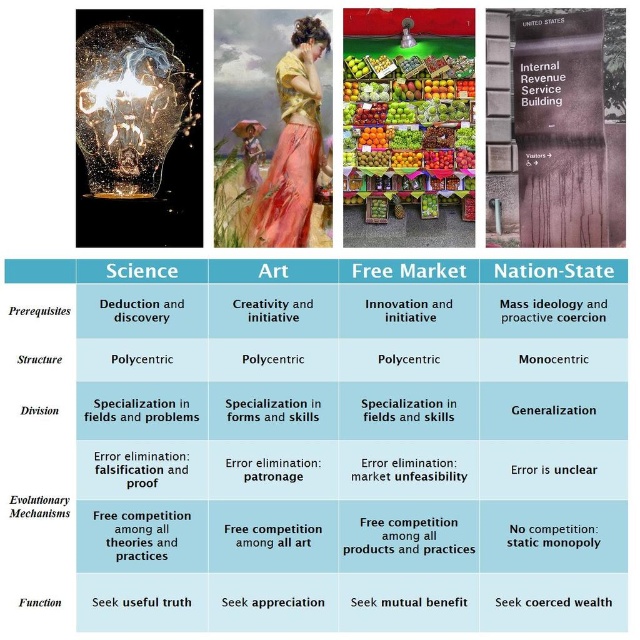
Does translucent glass bulb at upper left have a greater width compared to matte silver lamp at center?

Yes.

How distant is translucent glass bulb at upper left from matte silver lamp at center?

translucent glass bulb at upper left is 29.07 inches from matte silver lamp at center.

Locate an element on the screen. This screenshot has height=640, width=640. translucent glass bulb at upper left is located at coordinates (129, 106).

What do you see at coordinates (410, 131) in the screenshot? I see `shiny plastic fruits at center` at bounding box center [410, 131].

Is shiny plastic fruits at center smaller than translucent glass bulb at upper left?

Correct, shiny plastic fruits at center occupies less space than translucent glass bulb at upper left.

Who is more forward, [440,83] or [83,132]?

Point [83,132] is more forward.

The height and width of the screenshot is (640, 640). I want to click on shiny plastic fruits at center, so click(x=410, y=131).

Which is below, shiny plastic fruits at center or matte silver lamp at center?

shiny plastic fruits at center is below.

Is point (362, 164) in front of point (406, 45)?

No, (362, 164) is further to viewer.

What are the coordinates of `shiny plastic fruits at center` in the screenshot? It's located at (410, 131).